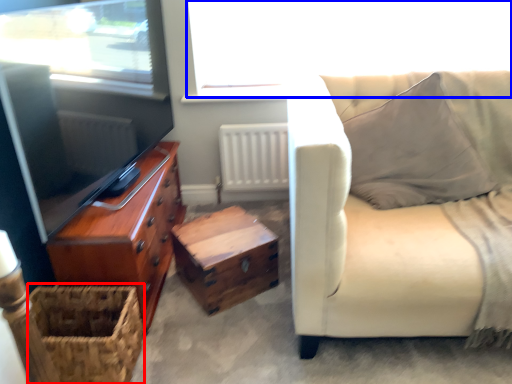
Question: Which object appears farthest to the camera in this image, basket (highlighted by a red box) or window screen (highlighted by a blue box)?

Choices:
 (A) basket
 (B) window screen

Answer: (B)